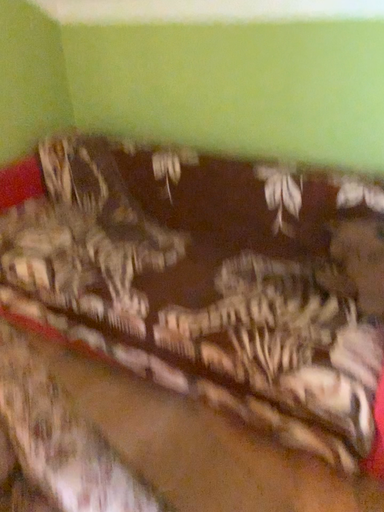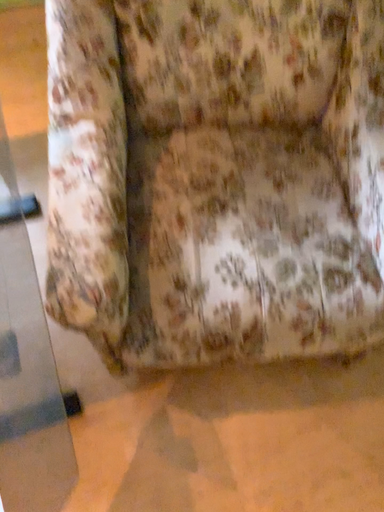
Question: Which way did the camera rotate in the video?

Choices:
 (A) rotated downward
 (B) rotated upward

Answer: (A)